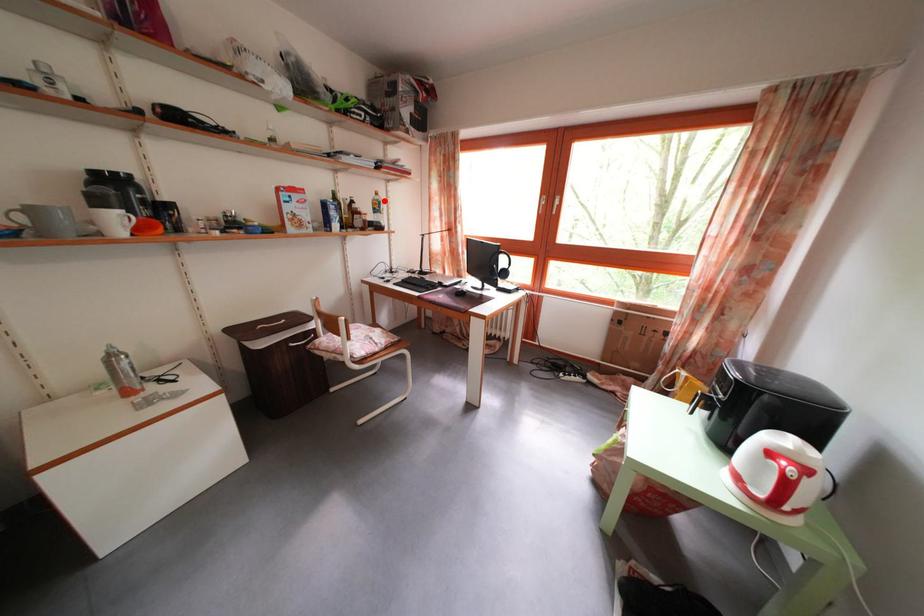
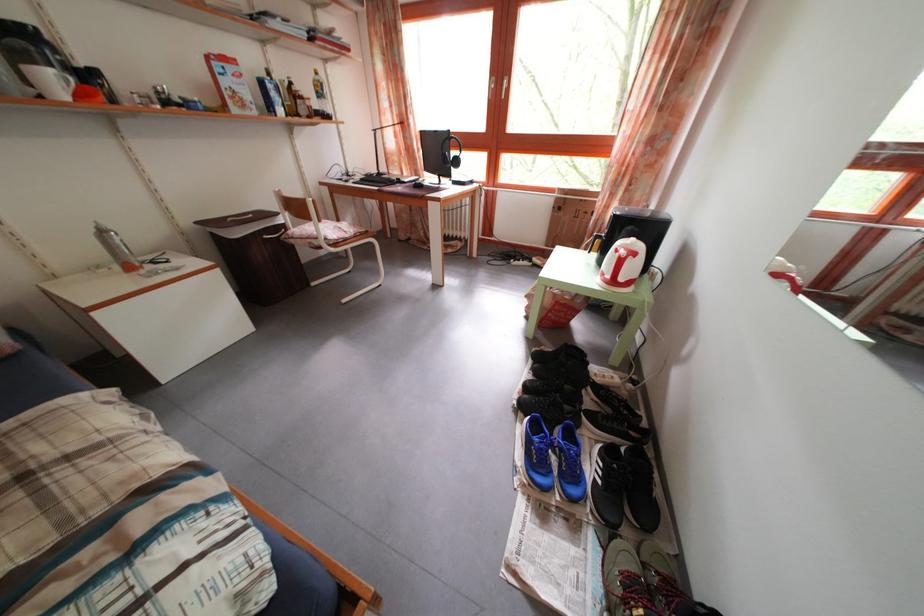
Question: A red point is marked in image1. In image2, is the corresponding 3D point closer to the camera or farther? Reply with the corresponding letter.

Choices:
 (A) The corresponding 3D point is closer.
 (B) The corresponding 3D point is farther.

Answer: (B)